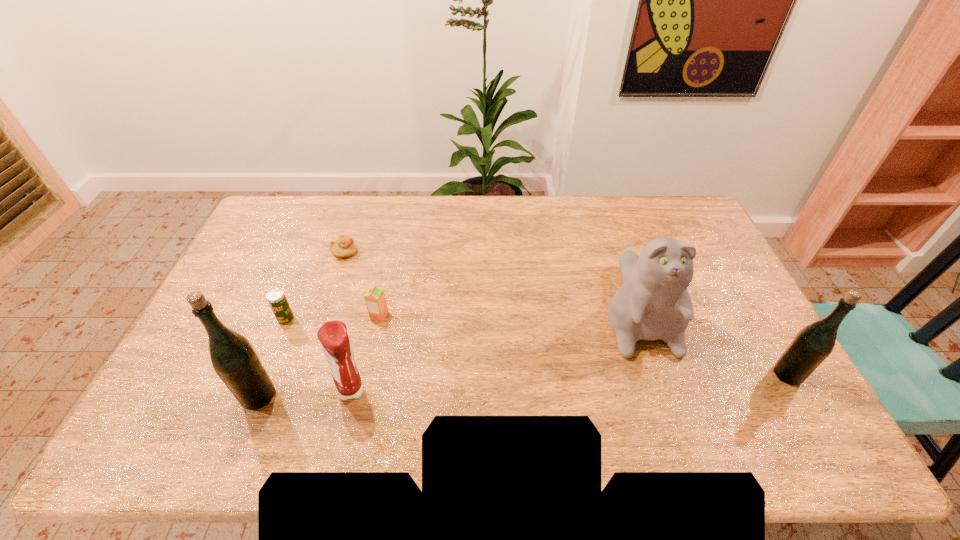
This screenshot has width=960, height=540. I want to click on vacant space that satisfies the following two spatial constraints: 1. on the front-facing side of the duckling; 2. on the right side of the rightmost object, so click(x=304, y=374).

This screenshot has width=960, height=540. I want to click on vacant point that satisfies the following two spatial constraints: 1. on the front-facing side of the condiment; 2. on the left side of the duckling, so click(300, 390).